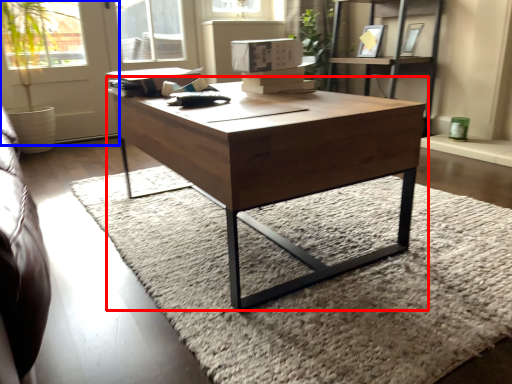
Question: Which object is closer to the camera taking this photo, coffee table (highlighted by a red box) or screen door (highlighted by a blue box)?

Choices:
 (A) coffee table
 (B) screen door

Answer: (A)